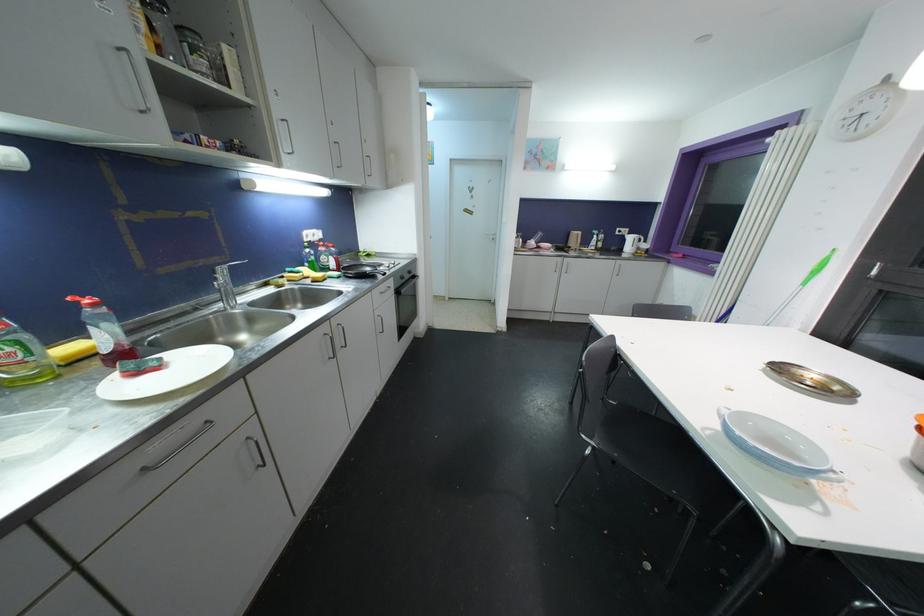
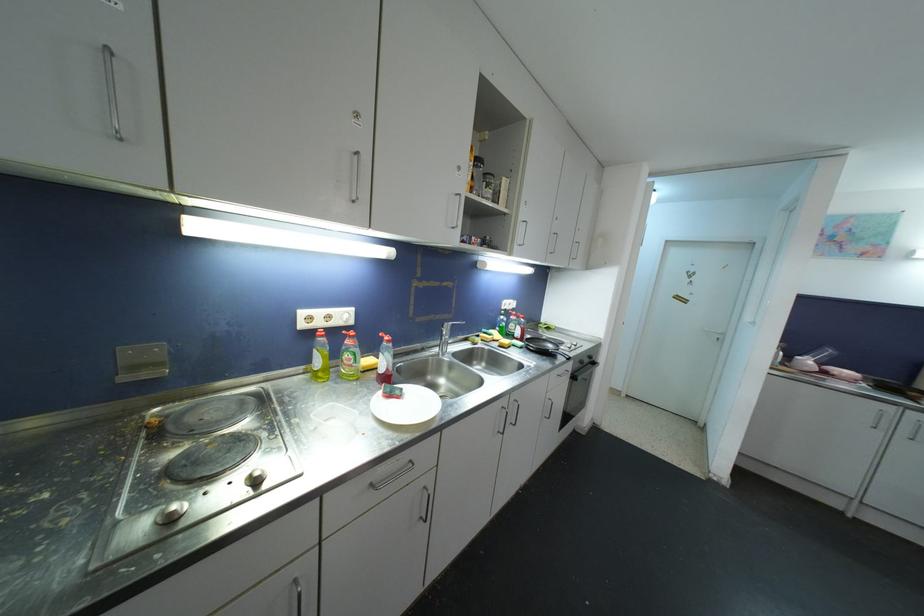
Question: The first image is from the beginning of the video and the second image is from the end. How did the camera likely rotate when shooting the video?

Choices:
 (A) Left
 (B) Right
 (C) Up
 (D) Down

Answer: (A)